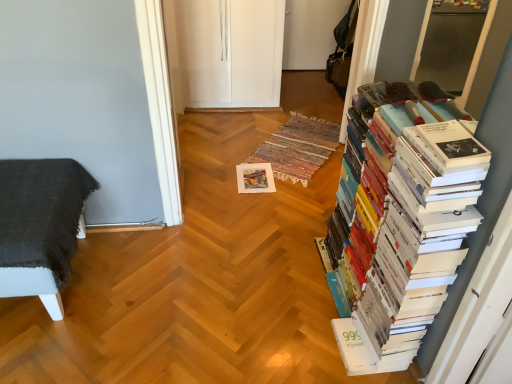
This screenshot has width=512, height=384. Find the location of `vacant space situated on the left part of white paper book at right`. vacant space situated on the left part of white paper book at right is located at coordinates (248, 297).